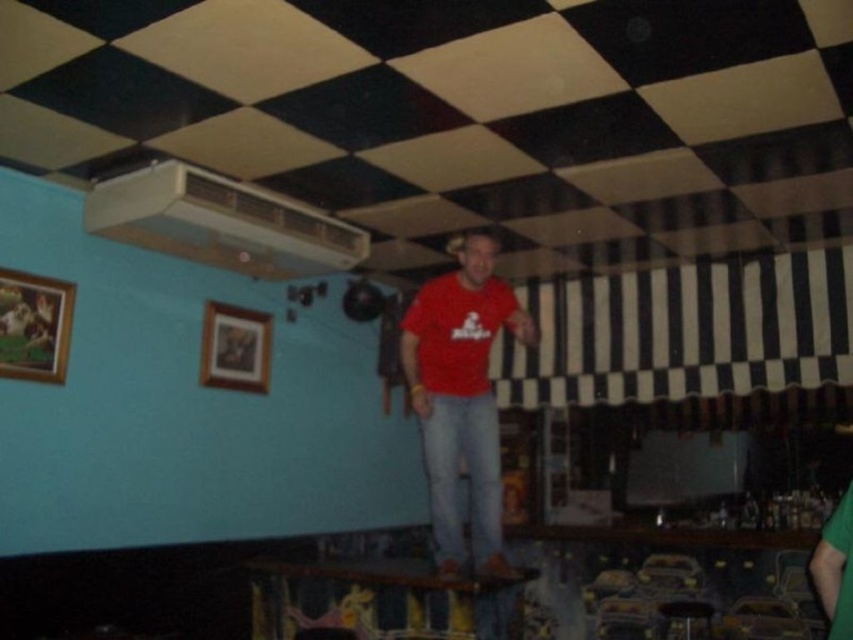
You are standing in the bar and want to place a new picture frame exactly where the red matte shirt at center is currently located. What are the coordinates of the spot where you should place the new frame?

The coordinates for the red matte shirt at center are at point (461,394), so you should place the new frame at those coordinates.

You are a customer at the bar and want to choose a shirt from the two displayed. The red matte shirt at center and the green fabric shirt at lower right are both on display. Which shirt is positioned more to the left side of the display?

The red matte shirt at center is positioned more to the left side of the display compared to the green fabric shirt at lower right.